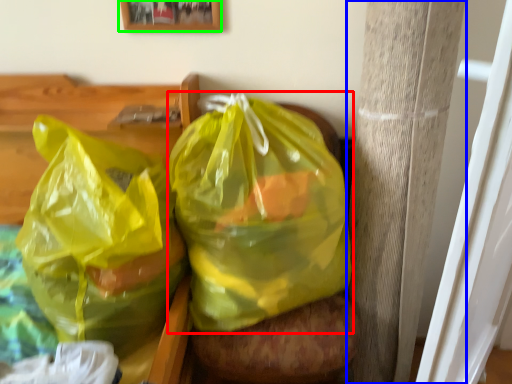
Question: Estimate the real-world distances between objects in this image. Which object is farther from plastic bag (highlighted by a red box), pillar (highlighted by a blue box) or picture frame (highlighted by a green box)?

Choices:
 (A) pillar
 (B) picture frame

Answer: (B)